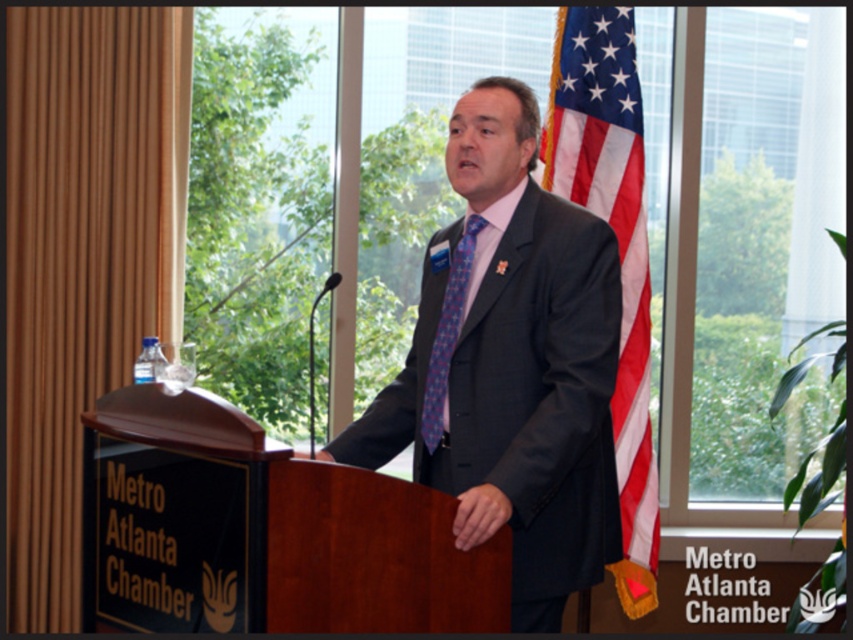
Question: Based on their relative distances, which object is farther from the blue textured tie at center?

Choices:
 (A) american flag at right
 (B) dark gray suit at center

Answer: (A)

Question: Which object is positioned closest to the dark gray suit at center?

Choices:
 (A) blue textured tie at center
 (B) american flag at right

Answer: (A)

Question: Is dark gray suit at center wider than american flag at right?

Choices:
 (A) yes
 (B) no

Answer: (A)

Question: Does dark gray suit at center appear on the left side of blue textured tie at center?

Choices:
 (A) no
 (B) yes

Answer: (A)

Question: Does dark gray suit at center have a greater width compared to american flag at right?

Choices:
 (A) yes
 (B) no

Answer: (A)

Question: Which point is closer to the camera?

Choices:
 (A) dark gray suit at center
 (B) american flag at right
 (C) blue textured tie at center

Answer: (A)